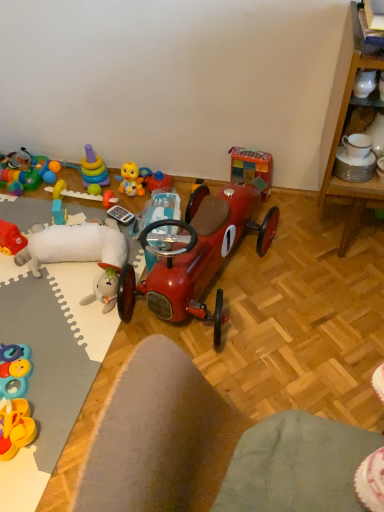
Find the location of a particular element. vacant region in front of wooden cabinet at right is located at coordinates (337, 303).